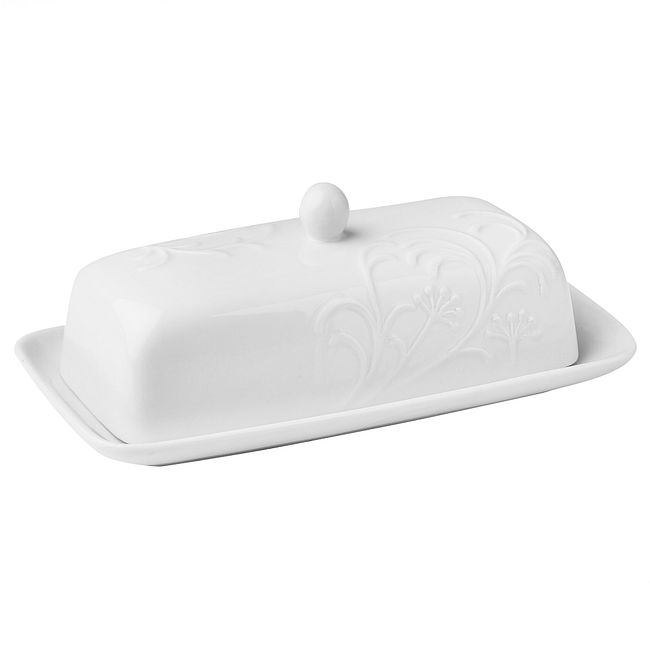
You are a GUI agent. You are given a task and a screenshot of the screen. Output one action in this format:
    pyautogui.click(x=<x>, y=<y>)
    Task: Click on the butter dish
    
    Given the screenshot: What is the action you would take?
    pyautogui.click(x=331, y=367)